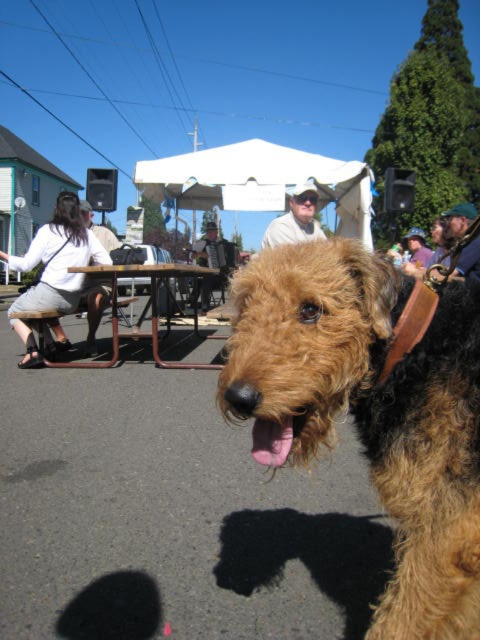
Is brown furry dog at center shorter than white shirt at upper left?

In fact, brown furry dog at center may be taller than white shirt at upper left.

Who is shorter, brown furry dog at center or white shirt at upper left?

white shirt at upper left is shorter.

Is point (457, 372) positioned before point (108, 232)?

Yes, it is in front of point (108, 232).

Where is `brown furry dog at center`? brown furry dog at center is located at coordinates (370, 410).

What do you see at coordinates (417, 250) in the screenshot?
I see `matte purple shirt at center` at bounding box center [417, 250].

Which is behind, point (420, 236) or point (97, 236)?

Point (420, 236)

At what (x,y) coordinates should I click in order to perform the action: click on matte purple shirt at center. Please return your answer as a coordinate pair (x, y). Image resolution: width=480 pixels, height=640 pixels. Looking at the image, I should click on (417, 250).

Is brown metal table at center thinner than matte purple shirt at center?

Incorrect, brown metal table at center's width is not less than matte purple shirt at center's.

Can you confirm if brown metal table at center is positioned below matte purple shirt at center?

Indeed, brown metal table at center is positioned under matte purple shirt at center.

The width and height of the screenshot is (480, 640). I want to click on brown metal table at center, so click(x=149, y=305).

The width and height of the screenshot is (480, 640). I want to click on brown metal table at center, so click(149, 305).